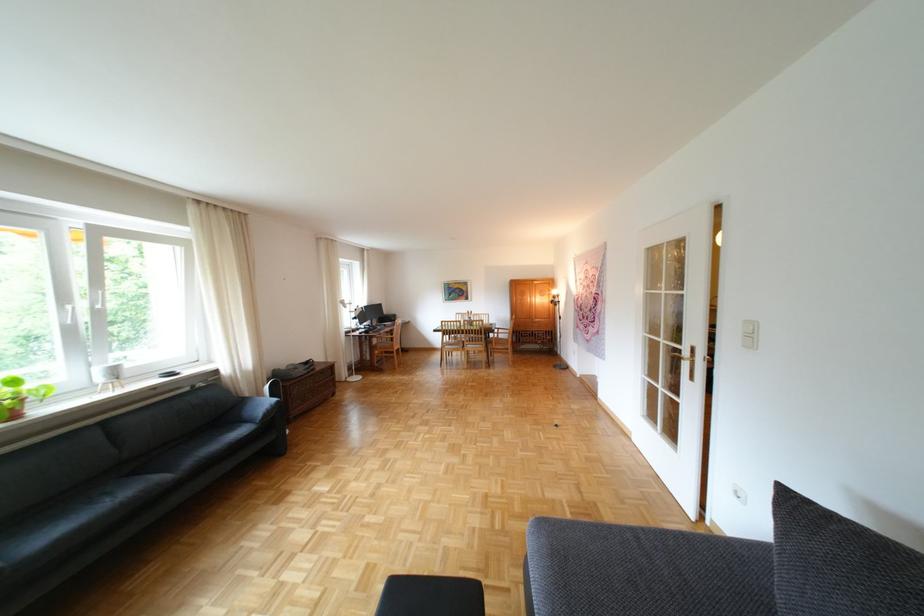
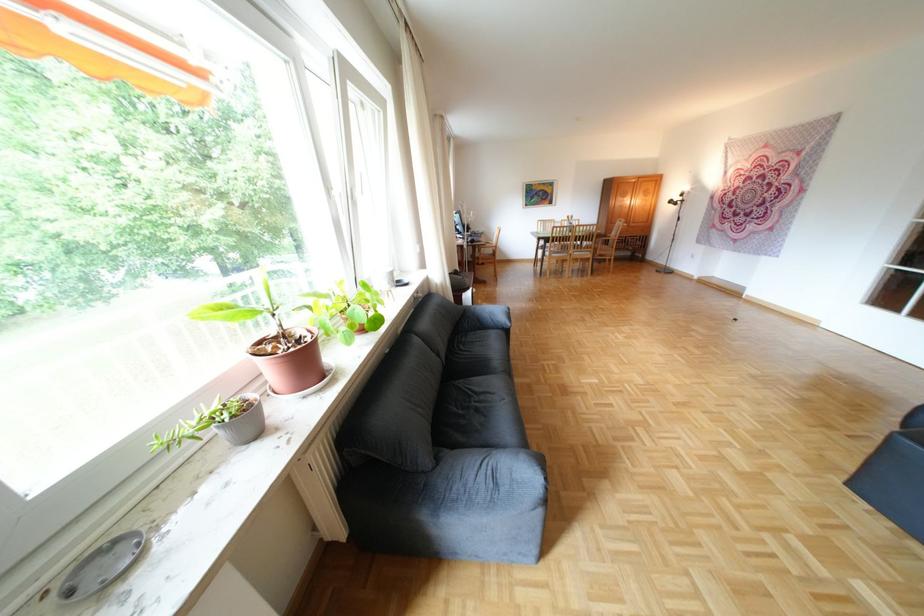
Question: The images are taken continuously from a first-person perspective. In which direction are you moving?

Choices:
 (A) Left
 (B) Right
 (C) Forward
 (D) Backward

Answer: (A)